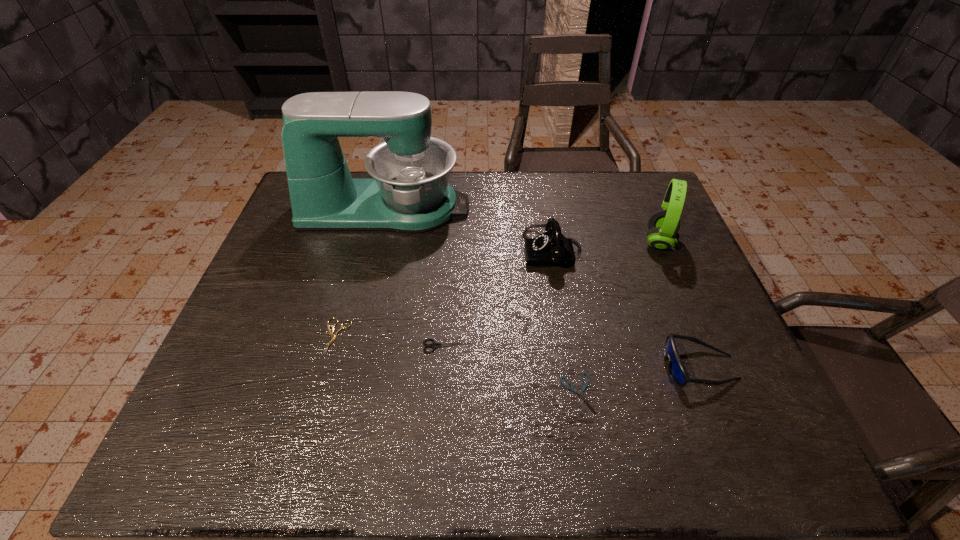
Identify the location of vacant space located on the left of the rightmost shears. The height and width of the screenshot is (540, 960). (510, 394).

The height and width of the screenshot is (540, 960). Find the location of `object located at the far edge`. object located at the far edge is located at coordinates (410, 193).

The height and width of the screenshot is (540, 960). Find the location of `object positioned at the left edge`. object positioned at the left edge is located at coordinates (410, 193).

At what (x,y) coordinates should I click in order to perform the action: click on headset at the right edge. Please return your answer as a coordinate pair (x, y). The width and height of the screenshot is (960, 540). Looking at the image, I should click on (663, 225).

Find the location of a particular element. The height and width of the screenshot is (540, 960). sunglasses located at the right edge is located at coordinates (676, 368).

I want to click on object that is at the far left corner, so click(x=410, y=193).

Locate an element on the screen. The image size is (960, 540). vacant space at the far edge of the desktop is located at coordinates (571, 174).

Where is `vacant region at the left edge`? This screenshot has width=960, height=540. vacant region at the left edge is located at coordinates (248, 296).

Where is `free space at the right edge of the desktop`? free space at the right edge of the desktop is located at coordinates (641, 254).

Find the location of a particular element. The image size is (960, 540). free space between the second shortest object and the tallest shears is located at coordinates (392, 342).